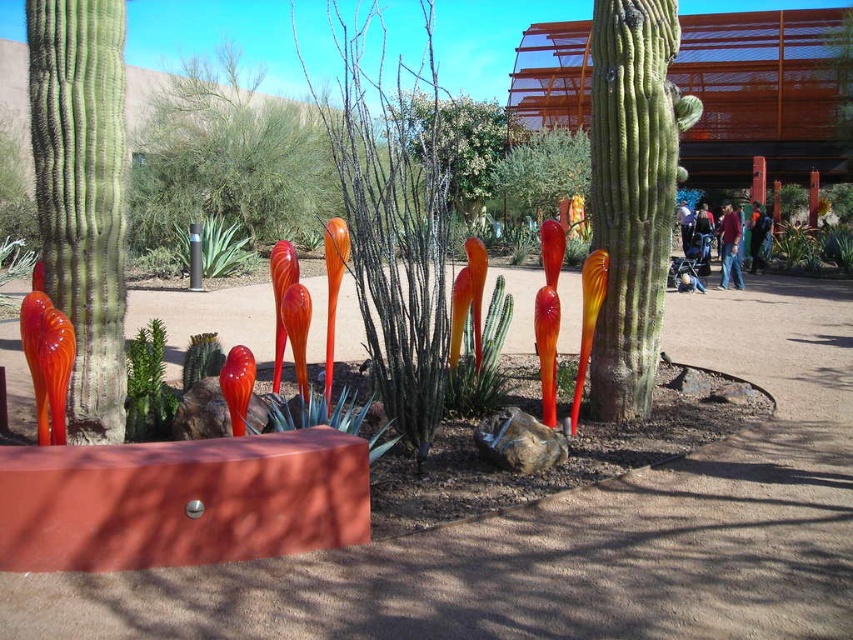
You are standing in the desert garden and want to take a photo of the translucent orange glass cactus at center. If your camera has a maximum focus range of 5 meters, will you be able to focus on it?

The translucent orange glass cactus at center is 6.03 meters away from the camera, which exceeds the maximum focus range of 5 meters. Therefore, the camera cannot focus on it.

You are standing in the desert garden and want to water the green matte plant at center. Your watering can has a maximum reach of 5 meters. Can you reach the plant without moving closer?

The green matte plant at center is 5.40 meters away from the viewer. Since the watering can only reaches up to 5 meters, you cannot reach the plant without moving closer.

You are a gardener planning to water the green leafy plant at center and the translucent orange glass cactus at center. Since both are at the center, how do you know which one is on the right side?

The translucent orange glass cactus at center is to the right of the green leafy plant at center, so the orange glass cactus is on the right side.